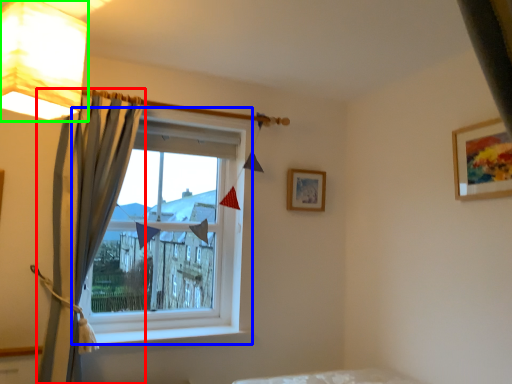
Question: Which object is positioned closest to curtain (highlighted by a red box)? Select from window (highlighted by a blue box) and lamp (highlighted by a green box).

Choices:
 (A) window
 (B) lamp

Answer: (A)